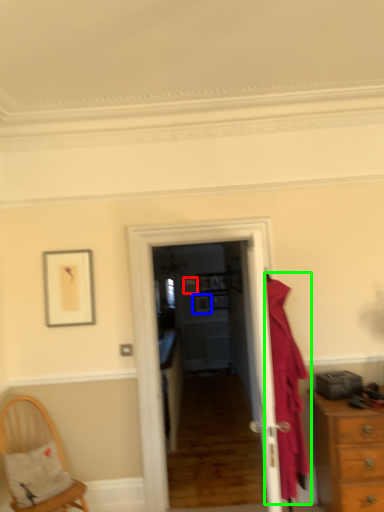
Question: Based on their relative distances, which object is farther from picture frame (highlighted by a red box)? Choose from picture frame (highlighted by a blue box) and clothing (highlighted by a green box).

Choices:
 (A) picture frame
 (B) clothing

Answer: (B)